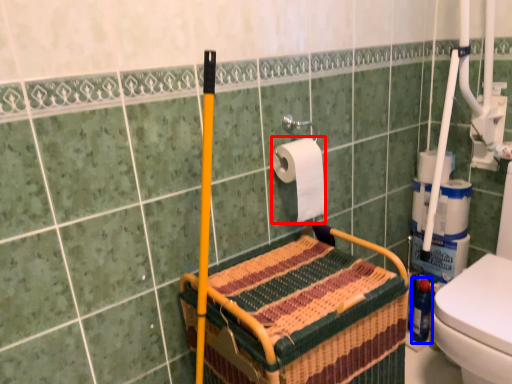
Question: Which of the following is the farthest to the observer, toilet paper (highlighted by a red box) or bottle (highlighted by a blue box)?

Choices:
 (A) toilet paper
 (B) bottle

Answer: (B)